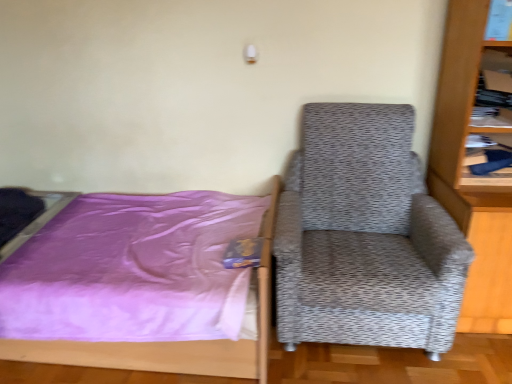
Measure the distance between point [502,222] and camera.

They are 5.51 feet apart.

Locate an element on the screen. wooden bookcase at right is located at coordinates (463, 169).

Is purple satin bed at left at the left side of wooden bookcase at right?

Indeed, purple satin bed at left is positioned on the left side of wooden bookcase at right.

Can you tell me how much purple satin bed at left and wooden bookcase at right differ in facing direction?

There is a 87.8-degree angle between the facing directions of purple satin bed at left and wooden bookcase at right.

Does point (268, 218) lie behind point (466, 23)?

No.

Does purple satin bed at left have a smaller size compared to wooden bookcase at right?

Incorrect, purple satin bed at left is not smaller in size than wooden bookcase at right.

From a real-world perspective, does purple satin bed at left sit lower than gray textured armchair at right?

Yes.

Which object is thinner, purple satin bed at left or gray textured armchair at right?

Thinner between the two is gray textured armchair at right.

Consider the image. Which point is more forward, (181,371) or (376,141)?

Positioned in front is point (181,371).

From a real-world perspective, between wooden bookcase at right and purple satin bed at left, who is vertically lower?

purple satin bed at left.

Which is more to the right, wooden bookcase at right or purple satin bed at left?

Positioned to the right is wooden bookcase at right.

Identify the location of bookcase above the purple satin bed at left (from a real-world perspective). The width and height of the screenshot is (512, 384). (463, 169).

Which is further, [505,69] or [453,324]?

The point [505,69] is behind.

Is wooden bookshelf at upper right aimed at gray textured armchair at right?

No, wooden bookshelf at upper right is not aimed at gray textured armchair at right.

In terms of size, does wooden bookshelf at upper right appear bigger or smaller than gray textured armchair at right?

wooden bookshelf at upper right is smaller than gray textured armchair at right.

Which object is further away from the camera taking this photo, wooden bookshelf at upper right or gray textured armchair at right?

wooden bookshelf at upper right is further from the camera.

What's the angular difference between purple satin bed at left and wooden bookshelf at upper right's facing directions?

The angle between the facing direction of purple satin bed at left and the facing direction of wooden bookshelf at upper right is 86.3 degrees.

Consider the image. Does purple satin bed at left have a larger size compared to wooden bookshelf at upper right?

Correct, purple satin bed at left is larger in size than wooden bookshelf at upper right.

Can we say purple satin bed at left lies outside wooden bookshelf at upper right?

purple satin bed at left is positioned outside wooden bookshelf at upper right.

Which of these two, purple satin bed at left or wooden bookshelf at upper right, stands taller?

purple satin bed at left is taller.

From a real-world perspective, is gray textured armchair at right on top of wooden bookcase at right?

Incorrect, from a real-world perspective, gray textured armchair at right is lower than wooden bookcase at right.

How many degrees apart are the facing directions of gray textured armchair at right and wooden bookcase at right?

The facing directions of gray textured armchair at right and wooden bookcase at right are 2.06 degrees apart.

Is gray textured armchair at right thinner than wooden bookcase at right?

No.

Are gray textured armchair at right and wooden bookcase at right making contact?

gray textured armchair at right and wooden bookcase at right are clearly separated.

Between wooden bookcase at right and gray textured armchair at right, which one is positioned behind?

gray textured armchair at right is further away from the camera.

From the image's perspective, does wooden bookcase at right appear lower than gray textured armchair at right?

No.

Consider the image. Who is taller, wooden bookcase at right or gray textured armchair at right?

Standing taller between the two is wooden bookcase at right.

Which is correct: wooden bookcase at right is inside gray textured armchair at right, or outside of it?

wooden bookcase at right is spatially situated outside gray textured armchair at right.

Find the location of a particular element. The image size is (512, 384). bookcase in front of the purple satin bed at left is located at coordinates (463, 169).

Find the location of a particular element. The height and width of the screenshot is (384, 512). chair to the right of purple satin bed at left is located at coordinates (365, 236).

From the image, which object appears to be farther from purple satin bed at left, wooden bookshelf at upper right or wooden bookcase at right?

Based on the image, wooden bookshelf at upper right appears to be further to purple satin bed at left.

Estimate the real-world distances between objects in this image. Which object is further from purple satin bed at left, wooden bookshelf at upper right or gray textured armchair at right?

wooden bookshelf at upper right is positioned further to the anchor purple satin bed at left.

Based on their spatial positions, is wooden bookshelf at upper right or gray textured armchair at right closer to wooden bookcase at right?

wooden bookshelf at upper right is closer to wooden bookcase at right.

When comparing their distances from wooden bookshelf at upper right, does wooden bookcase at right or purple satin bed at left seem further?

purple satin bed at left is positioned further to the anchor wooden bookshelf at upper right.

When comparing their distances from gray textured armchair at right, does wooden bookshelf at upper right or purple satin bed at left seem closer?

purple satin bed at left.

Looking at the image, which one is located further to wooden bookcase at right, wooden bookshelf at upper right or purple satin bed at left?

purple satin bed at left lies further to wooden bookcase at right than the other object.

Estimate the real-world distances between objects in this image. Which object is further from wooden bookshelf at upper right, purple satin bed at left or gray textured armchair at right?

purple satin bed at left is positioned further to the anchor wooden bookshelf at upper right.

Estimate the real-world distances between objects in this image. Which object is closer to wooden bookshelf at upper right, gray textured armchair at right or wooden bookcase at right?

wooden bookcase at right lies closer to wooden bookshelf at upper right than the other object.

In order to click on shelf situated between gray textured armchair at right and wooden bookcase at right from left to right in this screenshot , I will do `click(495, 90)`.

The image size is (512, 384). I want to click on chair located between purple satin bed at left and wooden bookshelf at upper right in the left-right direction, so click(x=365, y=236).

Locate an element on the screen. This screenshot has width=512, height=384. shelf between purple satin bed at left and wooden bookcase at right in the horizontal direction is located at coordinates click(x=495, y=90).

This screenshot has width=512, height=384. I want to click on chair situated between purple satin bed at left and wooden bookcase at right from left to right, so click(365, 236).